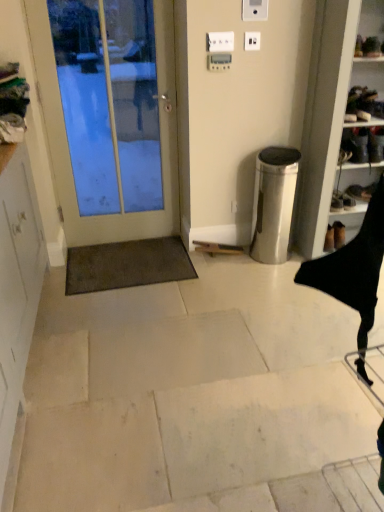
Question: From the image's perspective, is white glossy door at left beneath black leather shoes at right?

Choices:
 (A) no
 (B) yes

Answer: (A)

Question: From the image's perspective, is white glossy door at left on top of black leather shoes at right?

Choices:
 (A) no
 (B) yes

Answer: (B)

Question: Considering the relative sizes of white glossy door at left and black leather shoes at right in the image provided, is white glossy door at left wider than black leather shoes at right?

Choices:
 (A) yes
 (B) no

Answer: (B)

Question: Considering the relative sizes of white glossy door at left and black leather shoes at right in the image provided, is white glossy door at left shorter than black leather shoes at right?

Choices:
 (A) yes
 (B) no

Answer: (B)

Question: Can you confirm if white glossy door at left is thinner than black leather shoes at right?

Choices:
 (A) yes
 (B) no

Answer: (A)

Question: Does white glossy door at left have a larger size compared to black leather shoes at right?

Choices:
 (A) yes
 (B) no

Answer: (A)

Question: Is white plastic electric outlet at upper center, which is the second electric outlet in left-to-right order, further to camera compared to white plastic electric outlet at upper center, arranged as the first electric outlet when viewed from the left?

Choices:
 (A) no
 (B) yes

Answer: (B)

Question: Is white plastic electric outlet at upper center, which is the second electric outlet in left-to-right order, smaller than white plastic electric outlet at upper center, which appears as the 2th electric outlet when viewed from the right?

Choices:
 (A) no
 (B) yes

Answer: (B)

Question: Is white plastic electric outlet at upper center, which is the second electric outlet in left-to-right order, surrounding white plastic electric outlet at upper center, arranged as the first electric outlet when viewed from the left?

Choices:
 (A) yes
 (B) no

Answer: (B)

Question: From the image's perspective, is white plastic electric outlet at upper center, which is the second electric outlet in left-to-right order, above white plastic electric outlet at upper center, which appears as the 2th electric outlet when viewed from the right?

Choices:
 (A) no
 (B) yes

Answer: (B)

Question: Are white plastic electric outlet at upper center, which is the second electric outlet in left-to-right order, and white plastic electric outlet at upper center, which appears as the 2th electric outlet when viewed from the right, far apart?

Choices:
 (A) no
 (B) yes

Answer: (A)

Question: Considering the relative positions of white plastic electric outlet at upper center, which appears as the 1th electric outlet when viewed from the right, and white plastic electric outlet at upper center, which appears as the 2th electric outlet when viewed from the right, in the image provided, is white plastic electric outlet at upper center, which appears as the 1th electric outlet when viewed from the right, to the left of white plastic electric outlet at upper center, which appears as the 2th electric outlet when viewed from the right, from the viewer's perspective?

Choices:
 (A) no
 (B) yes

Answer: (A)

Question: Does white matte cabinet at left have a lesser height compared to white plastic electric outlet at upper center, arranged as the first electric outlet when viewed from the left?

Choices:
 (A) no
 (B) yes

Answer: (A)